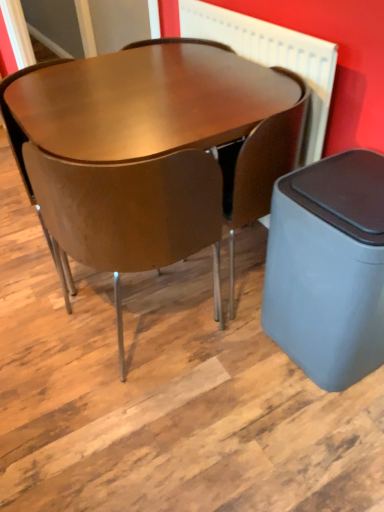
I want to click on vacant space that is to the left of matte brown chair at center, the second chair positioned from the right, so click(x=43, y=335).